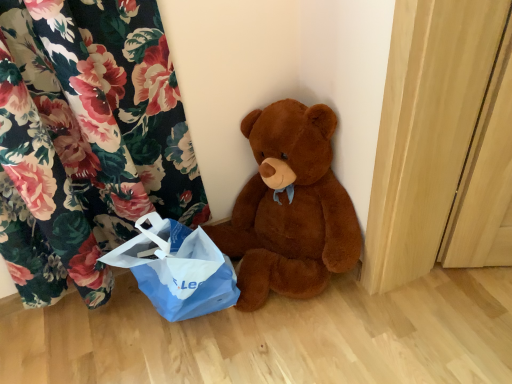
Question: Considering the positions of brown plush teddy bear at center and blue paper bag at lower left in the image, is brown plush teddy bear at center taller or shorter than blue paper bag at lower left?

Choices:
 (A) tall
 (B) short

Answer: (A)

Question: From a real-world perspective, is brown plush teddy bear at center physically located above or below blue paper bag at lower left?

Choices:
 (A) above
 (B) below

Answer: (A)

Question: In the image, is brown plush teddy bear at center on the left side or the right side of blue paper bag at lower left?

Choices:
 (A) right
 (B) left

Answer: (A)

Question: Is blue paper bag at lower left in front of or behind brown plush teddy bear at center in the image?

Choices:
 (A) front
 (B) behind

Answer: (B)

Question: From the image's perspective, is blue paper bag at lower left located above or below brown plush teddy bear at center?

Choices:
 (A) below
 (B) above

Answer: (A)

Question: Considering the positions of blue paper bag at lower left and brown plush teddy bear at center in the image, is blue paper bag at lower left wider or thinner than brown plush teddy bear at center?

Choices:
 (A) wide
 (B) thin

Answer: (B)

Question: Considering the positions of point (178, 273) and point (287, 210), is point (178, 273) closer or farther from the camera than point (287, 210)?

Choices:
 (A) farther
 (B) closer

Answer: (B)